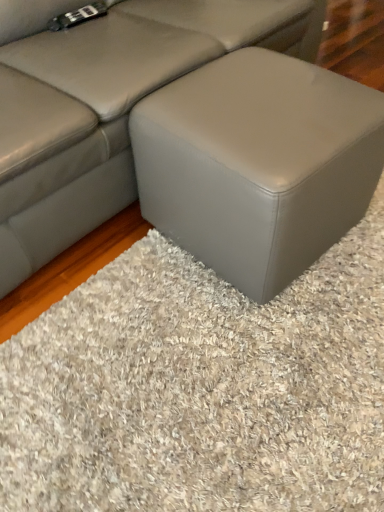
Question: Considering the relative positions of matte gray ottoman at center and matte gray ottoman at center in the image provided, is matte gray ottoman at center to the right of matte gray ottoman at center from the viewer's perspective?

Choices:
 (A) no
 (B) yes

Answer: (B)

Question: Considering the relative sizes of matte gray ottoman at center and matte gray ottoman at center in the image provided, is matte gray ottoman at center thinner than matte gray ottoman at center?

Choices:
 (A) no
 (B) yes

Answer: (B)

Question: Is matte gray ottoman at center further to the viewer compared to matte gray ottoman at center?

Choices:
 (A) yes
 (B) no

Answer: (A)

Question: Does matte gray ottoman at center have a greater width compared to matte gray ottoman at center?

Choices:
 (A) no
 (B) yes

Answer: (A)

Question: Can you confirm if matte gray ottoman at center is shorter than matte gray ottoman at center?

Choices:
 (A) no
 (B) yes

Answer: (B)

Question: From the image's perspective, is matte gray ottoman at center below matte gray ottoman at center?

Choices:
 (A) no
 (B) yes

Answer: (B)

Question: Can you confirm if matte gray ottoman at center is thinner than gray matte ottoman at center?

Choices:
 (A) yes
 (B) no

Answer: (B)

Question: From the image's perspective, is matte gray ottoman at center located beneath gray matte ottoman at center?

Choices:
 (A) yes
 (B) no

Answer: (B)

Question: Can you confirm if matte gray ottoman at center is positioned to the left of gray matte ottoman at center?

Choices:
 (A) no
 (B) yes

Answer: (B)

Question: Considering the relative positions of matte gray ottoman at center and gray matte ottoman at center in the image provided, is matte gray ottoman at center behind gray matte ottoman at center?

Choices:
 (A) no
 (B) yes

Answer: (B)

Question: Is matte gray ottoman at center at the right side of gray matte ottoman at center?

Choices:
 (A) yes
 (B) no

Answer: (B)

Question: From a real-world perspective, is matte gray ottoman at center positioned over gray matte ottoman at center based on gravity?

Choices:
 (A) no
 (B) yes

Answer: (B)

Question: Is matte gray ottoman at center turned away from matte gray ottoman at center?

Choices:
 (A) yes
 (B) no

Answer: (B)